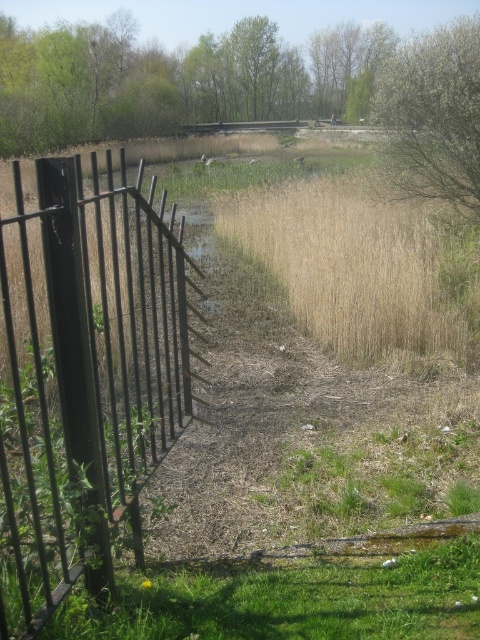
Question: Can you confirm if black metal fence at left is positioned above green leafy tree at upper right?

Choices:
 (A) no
 (B) yes

Answer: (A)

Question: Which point is closer to the camera?

Choices:
 (A) (382, 144)
 (B) (24, 400)

Answer: (B)

Question: Which point is farther to the camera?

Choices:
 (A) [x=465, y=122]
 (B) [x=84, y=204]

Answer: (A)

Question: Does black metal fence at left appear over green leafy tree at upper right?

Choices:
 (A) yes
 (B) no

Answer: (B)

Question: Is black metal fence at left thinner than green leafy tree at upper right?

Choices:
 (A) no
 (B) yes

Answer: (A)

Question: Among these points, which one is nearest to the camera?

Choices:
 (A) (135, 541)
 (B) (454, 35)

Answer: (A)